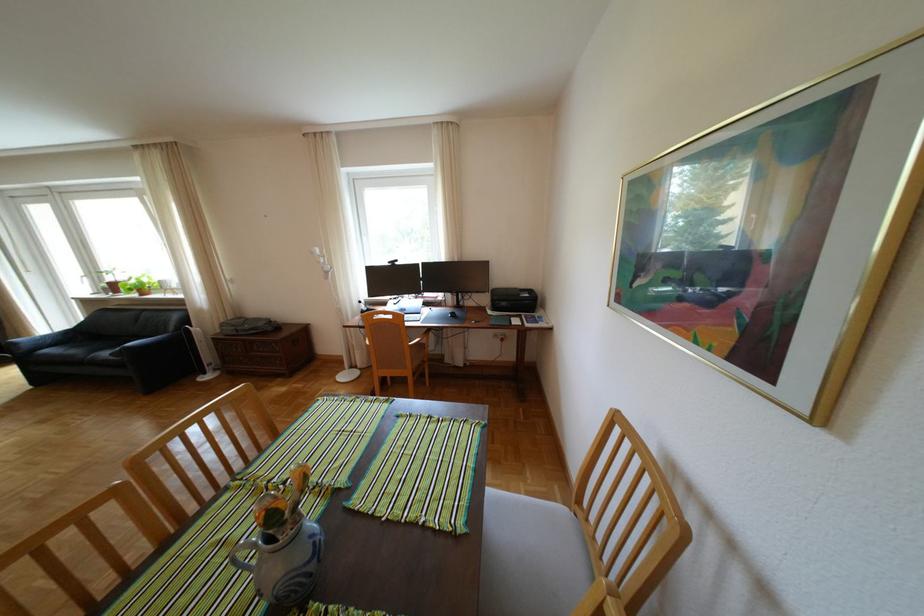
Find where to click the computer mouse. Please return your answer as a coordinate pair (x, y).

(456, 315)